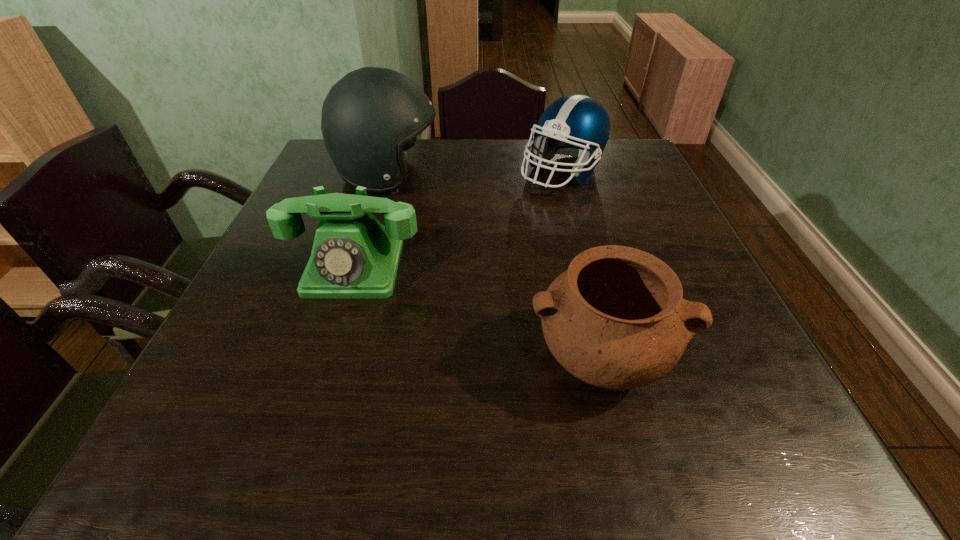
At what (x,y) coordinates should I click in order to perform the action: click on telephone that is positioned at the left edge. Please return your answer as a coordinate pair (x, y). This screenshot has height=540, width=960. Looking at the image, I should click on (353, 256).

The width and height of the screenshot is (960, 540). Find the location of `football helmet that is positioned at the right edge`. football helmet that is positioned at the right edge is located at coordinates click(576, 125).

I want to click on pottery located in the right edge section of the desktop, so click(616, 318).

This screenshot has width=960, height=540. In order to click on object positioned at the far left corner in this screenshot , I will do 371,117.

Locate an element on the screen. The width and height of the screenshot is (960, 540). object that is at the far right corner is located at coordinates (576, 125).

This screenshot has width=960, height=540. Find the location of `free space at the far edge of the desktop`. free space at the far edge of the desktop is located at coordinates (516, 146).

The height and width of the screenshot is (540, 960). Identify the location of free space at the near edge of the desktop. (523, 449).

Where is `free spot at the left edge of the desktop`? This screenshot has height=540, width=960. free spot at the left edge of the desktop is located at coordinates (267, 253).

I want to click on vacant space at the right edge of the desktop, so click(x=645, y=204).

I want to click on free space at the near left corner of the desktop, so click(x=244, y=457).